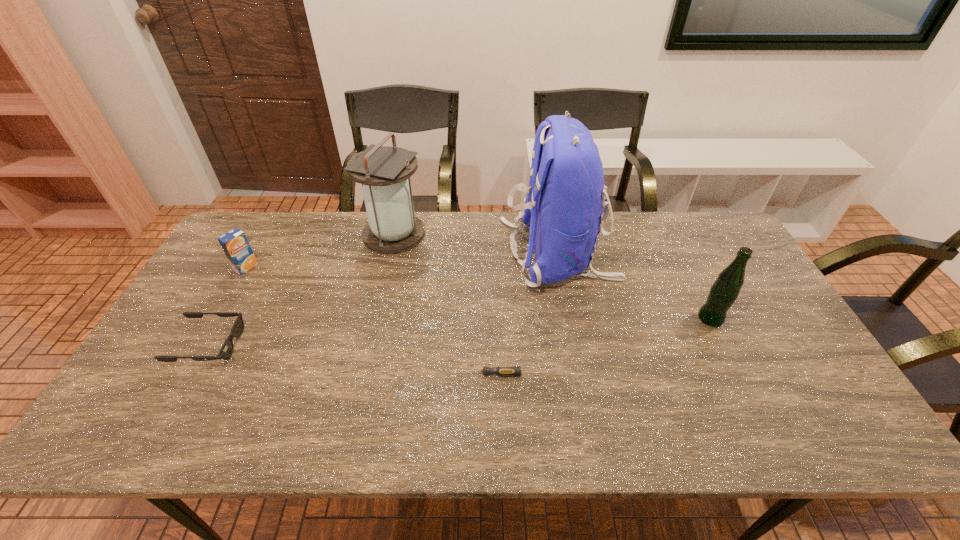
Where is `free space located on the back of the backpack`? The width and height of the screenshot is (960, 540). free space located on the back of the backpack is located at coordinates (400, 253).

Identify the location of free space located 0.120m on the back of the backpack. This screenshot has height=540, width=960. (465, 253).

Locate an element on the screen. vacant area located on the front of the fourth object from right to left is located at coordinates (367, 356).

Identify the location of free region located 0.240m on the left of the rightmost object. (612, 318).

Identify the location of free space located 0.370m on the front of the orange_juice. The image size is (960, 540). (183, 377).

Find the location of `vacant space located on the temples of the sunglasses`. vacant space located on the temples of the sunglasses is located at coordinates [x=348, y=345].

Where is `vacant area situated insert the nearest object into a screw head`? vacant area situated insert the nearest object into a screw head is located at coordinates (384, 374).

Identify the location of vacant area located 0.060m insert the nearest object into a screw head. The image size is (960, 540). (428, 374).

Where is `free spot located insert the nearest object into a screw head`? free spot located insert the nearest object into a screw head is located at coordinates (404, 374).

Identify the location of backpack positioned at the far edge. (564, 205).